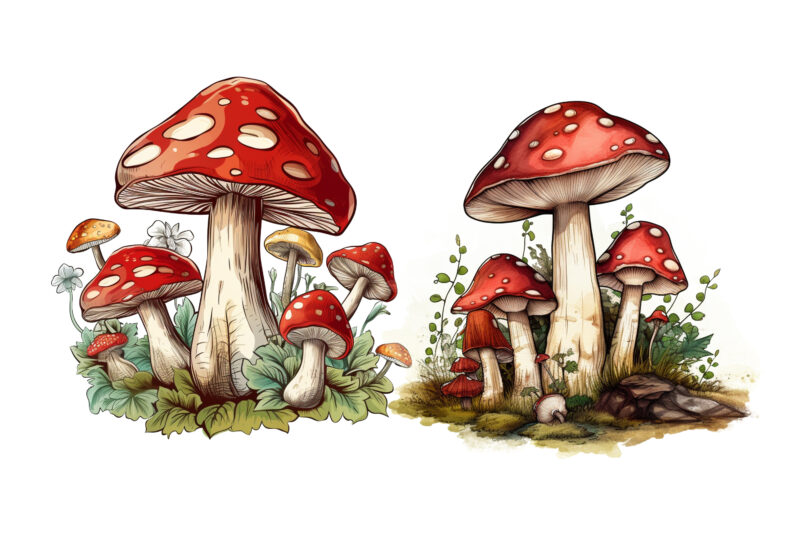
The width and height of the screenshot is (800, 533). I want to click on plant, so click(x=449, y=280).